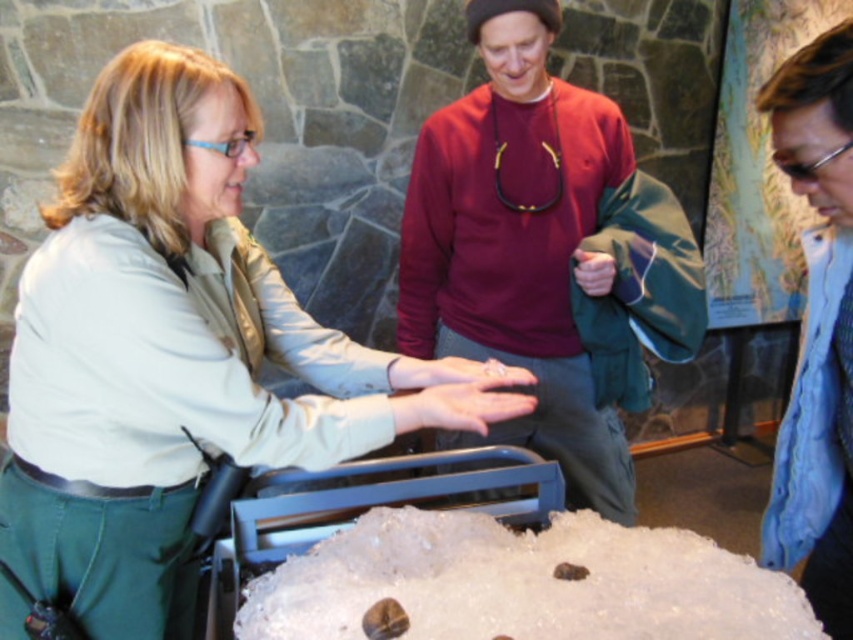
Question: Does maroon sweater at center appear on the left side of blue textured scarf at lower right?

Choices:
 (A) yes
 (B) no

Answer: (A)

Question: Does matte khaki shirt at center appear over translucent white ice at center?

Choices:
 (A) no
 (B) yes

Answer: (B)

Question: Which point is farther to the camera?

Choices:
 (A) (524, 227)
 (B) (822, 189)

Answer: (A)

Question: Which point appears farthest from the camera in this image?

Choices:
 (A) (372, 436)
 (B) (426, 252)

Answer: (B)

Question: Which object is positioned farthest from the translucent white ice at center?

Choices:
 (A) blue textured scarf at lower right
 (B) maroon sweater at center
 (C) matte khaki shirt at center

Answer: (B)

Question: Can you confirm if maroon sweater at center is positioned to the left of translucent white ice at center?

Choices:
 (A) no
 (B) yes

Answer: (A)